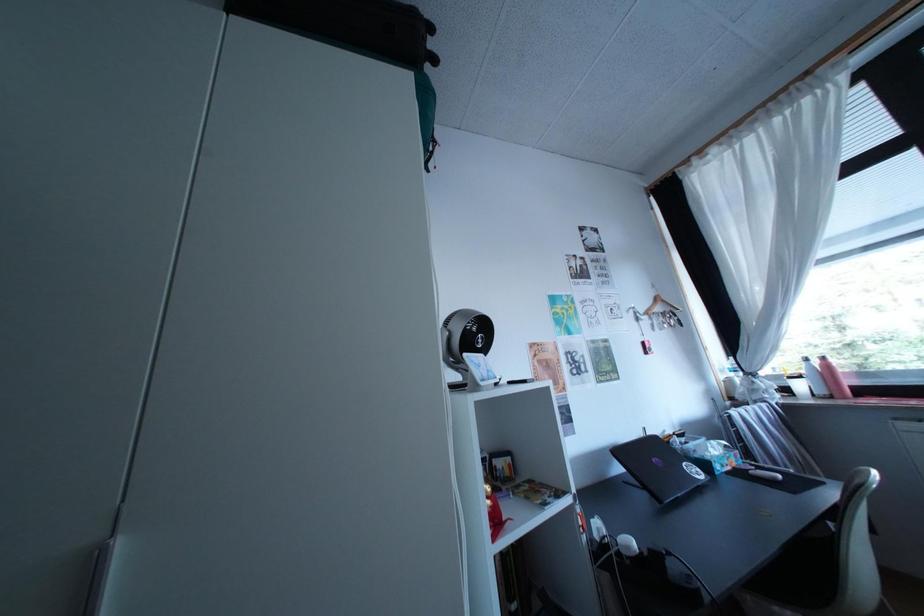
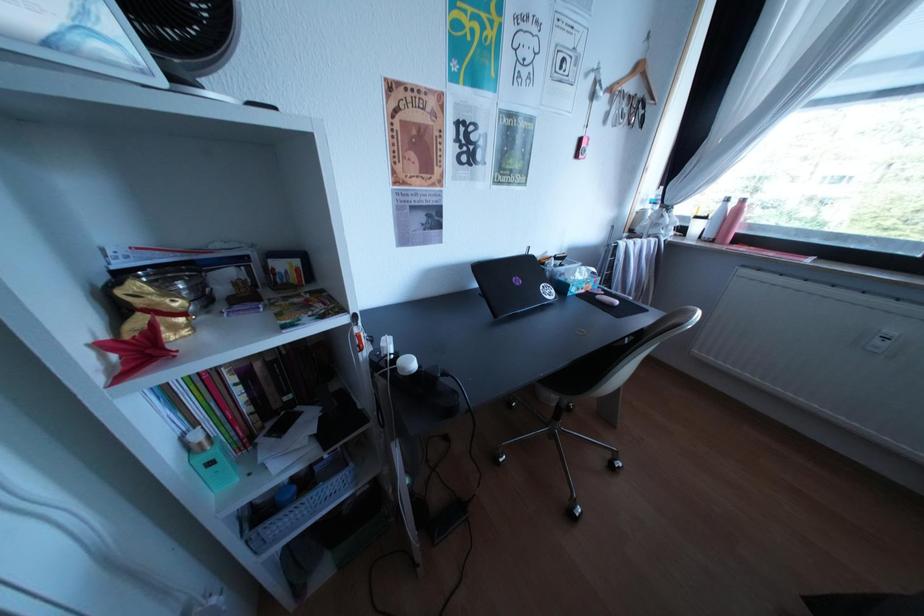
First-person continuous shooting, in which direction is the camera rotating?

The camera's rotation is toward right-down.